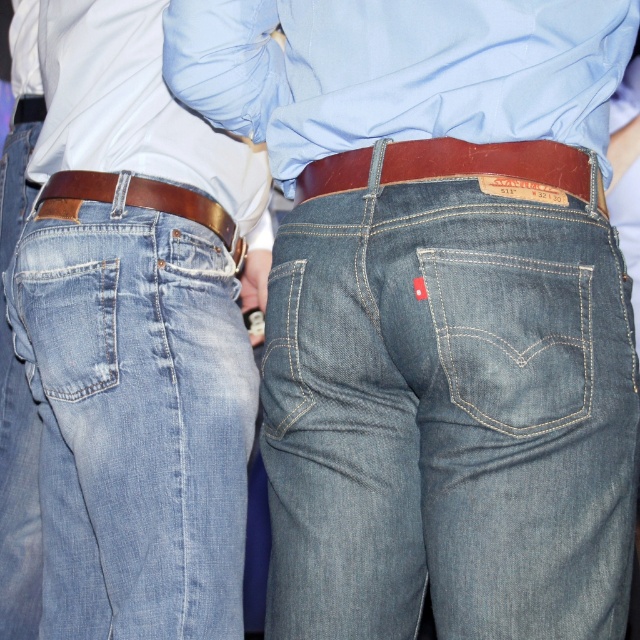
You are taking a photo of two people standing in front of you. You notice two specific points on their bodies marked as point 1 at coordinates point [547,372] and point 2 at coordinates point [467,156]. Based on their positions, which point is closer to your camera?

Point [547,372] is closer to the camera than point [467,156].

You are standing in a room and see the point at coordinates point (x=172, y=577). If you want to place a 1.5 meter long ruler from your current position to that point, will the entire ruler fit without bending?

The distance between you and the point (x=172, y=577) is 1.55 meters, which is slightly longer than the ruler. Therefore, the ruler cannot fully reach the point without bending.